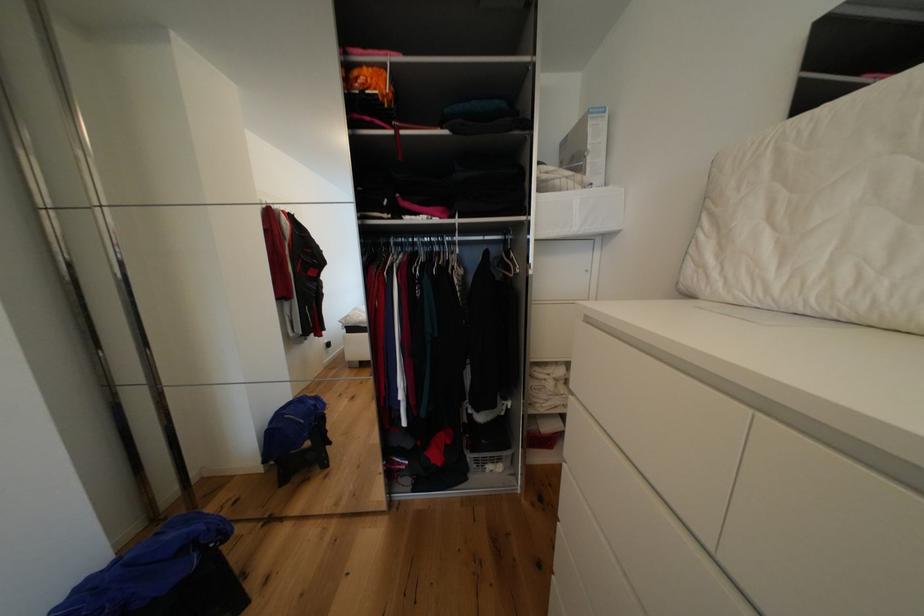
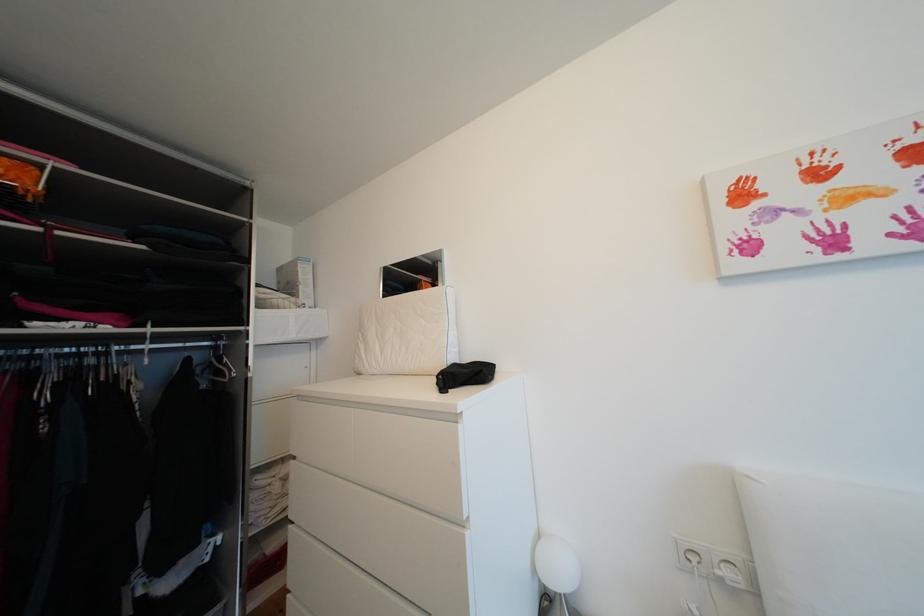
Question: The camera is either moving clockwise (left) or counter-clockwise (right) around the object. The first image is from the beginning of the video and the second image is from the end. Is the camera moving left or right when shooting the video?

Choices:
 (A) Left
 (B) Right

Answer: (A)